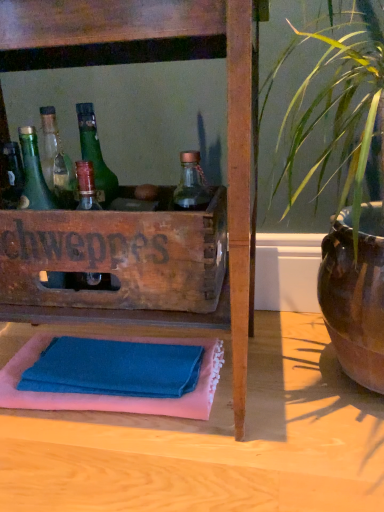
Question: Is wooden crate at center in front of blue cotton bath towel at lower center?

Choices:
 (A) yes
 (B) no

Answer: (A)

Question: Can you confirm if wooden crate at center is thinner than blue cotton bath towel at lower center?

Choices:
 (A) yes
 (B) no

Answer: (B)

Question: From the image's perspective, is wooden crate at center below blue cotton bath towel at lower center?

Choices:
 (A) yes
 (B) no

Answer: (B)

Question: Can you see wooden crate at center touching blue cotton bath towel at lower center?

Choices:
 (A) no
 (B) yes

Answer: (A)

Question: Considering the relative positions of wooden crate at center and blue cotton bath towel at lower center in the image provided, is wooden crate at center to the right of blue cotton bath towel at lower center from the viewer's perspective?

Choices:
 (A) no
 (B) yes

Answer: (A)

Question: In terms of height, does green glass bottle at left look taller or shorter compared to blue cotton bath towel at lower center?

Choices:
 (A) tall
 (B) short

Answer: (A)

Question: Is green glass bottle at left spatially inside blue cotton bath towel at lower center, or outside of it?

Choices:
 (A) inside
 (B) outside

Answer: (B)

Question: Based on their sizes in the image, would you say green glass bottle at left is bigger or smaller than blue cotton bath towel at lower center?

Choices:
 (A) big
 (B) small

Answer: (B)

Question: From a real-world perspective, is green glass bottle at left positioned above or below blue cotton bath towel at lower center?

Choices:
 (A) above
 (B) below

Answer: (A)

Question: Looking at their shapes, would you say wooden crate at center is wider or thinner than blue cotton bath towel at lower center?

Choices:
 (A) wide
 (B) thin

Answer: (A)

Question: In terms of height, does wooden crate at center look taller or shorter compared to blue cotton bath towel at lower center?

Choices:
 (A) tall
 (B) short

Answer: (A)

Question: Is wooden crate at center to the left or to the right of blue cotton bath towel at lower center in the image?

Choices:
 (A) right
 (B) left

Answer: (B)

Question: From the image's perspective, relative to blue cotton bath towel at lower center, is wooden crate at center above or below?

Choices:
 (A) below
 (B) above

Answer: (B)

Question: Considering the positions of point (29, 158) and point (71, 56), is point (29, 158) closer or farther from the camera than point (71, 56)?

Choices:
 (A) farther
 (B) closer

Answer: (A)

Question: Looking at their shapes, would you say green glass bottle at left is wider or thinner than wooden crate at center?

Choices:
 (A) wide
 (B) thin

Answer: (B)